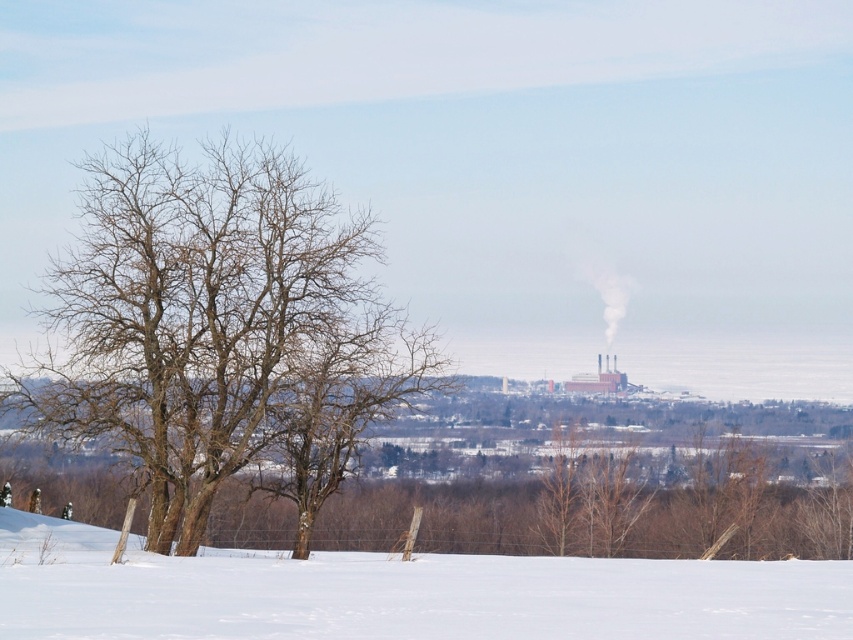
Between bare wood tree at left and white snow at lower center, which one is positioned lower?

A: white snow at lower center is lower down.

Between bare wood tree at left and white snow at lower center, which one has less height?

Standing shorter between the two is white snow at lower center.

Describe the element at coordinates (206, 314) in the screenshot. Image resolution: width=853 pixels, height=640 pixels. I see `bare wood tree at left` at that location.

Identify the location of bare wood tree at left. This screenshot has height=640, width=853. 206,314.